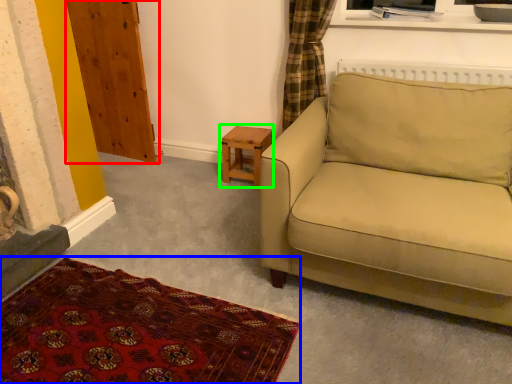
Question: Which object is positioned closest to armoire (highlighted by a red box)? Select from plain (highlighted by a blue box) and table (highlighted by a green box).

Choices:
 (A) plain
 (B) table

Answer: (B)